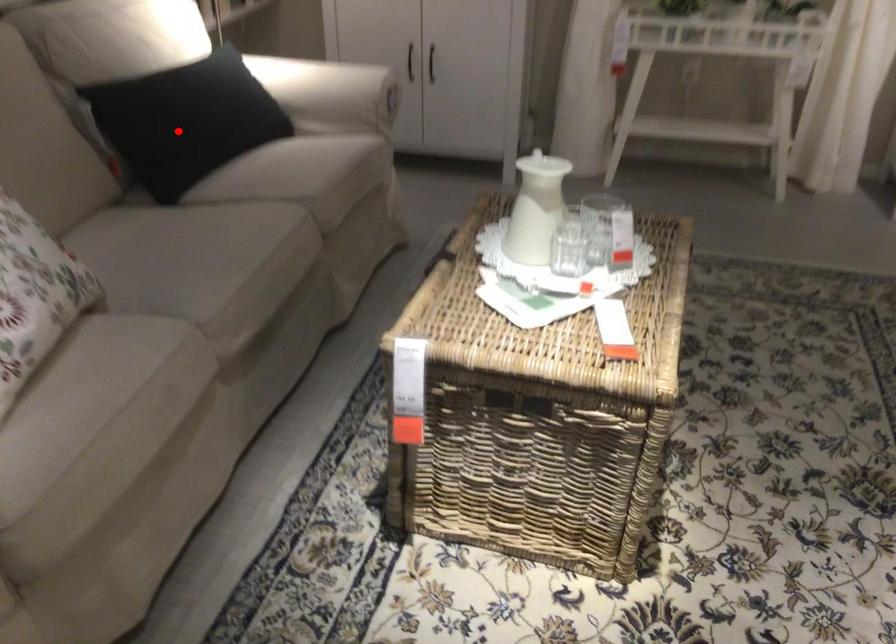
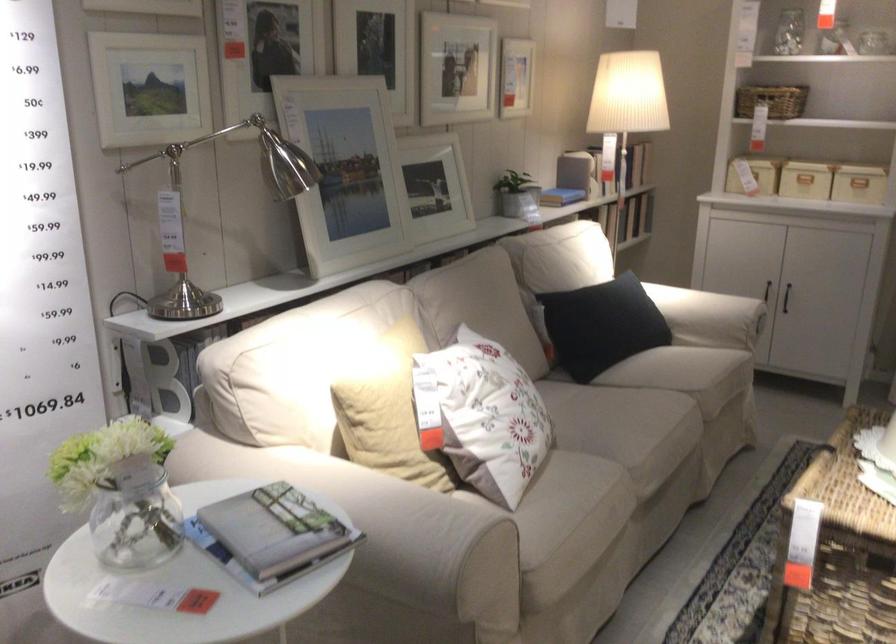
The point at the highlighted location is marked in the first image. Where is the corresponding point in the second image?

(600, 325)